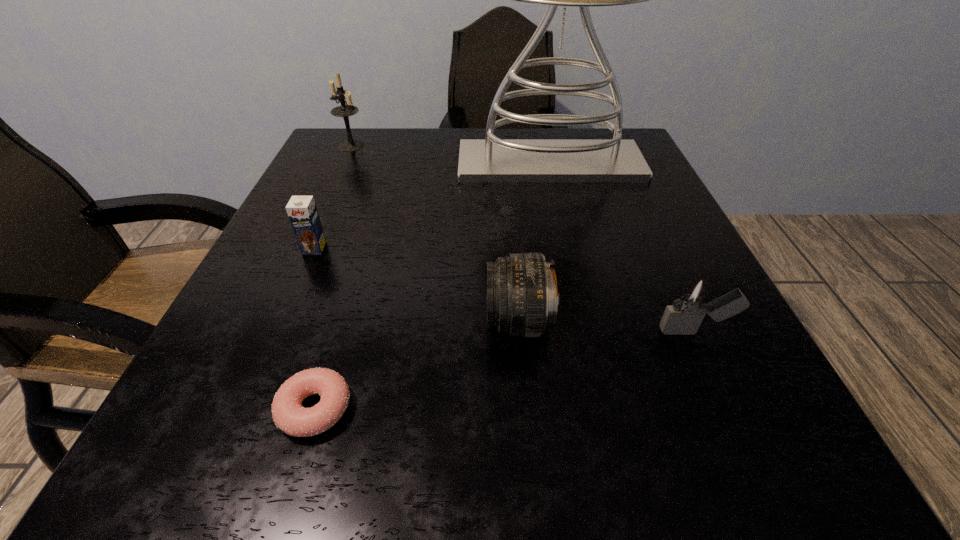
Find the location of a particular element. The height and width of the screenshot is (540, 960). free spot at the far left corner of the desktop is located at coordinates (370, 168).

This screenshot has height=540, width=960. In the image, there is a desktop. In order to click on vacant space at the near left corner in this screenshot , I will do `click(207, 418)`.

Find the location of a particular element. This screenshot has height=540, width=960. free space that is in between the third farthest object and the tallest object is located at coordinates (432, 206).

The image size is (960, 540). I want to click on unoccupied area between the table lamp and the fifth shortest object, so click(451, 155).

Locate an element on the screen. The height and width of the screenshot is (540, 960). free point between the table lamp and the igniter is located at coordinates [623, 247].

Locate an element on the screen. The width and height of the screenshot is (960, 540). free space between the candle holder and the igniter is located at coordinates (523, 238).

Locate an element on the screen. unoccupied area between the doughnut and the chocolate milk is located at coordinates point(315,328).

Locate an element on the screen. The height and width of the screenshot is (540, 960). free point between the second tallest object and the doughnut is located at coordinates (333, 277).

Find the location of a particular element. Image resolution: width=960 pixels, height=540 pixels. blank region between the nearest object and the candle holder is located at coordinates (333, 277).

Locate an element on the screen. This screenshot has height=540, width=960. vacant area that lies between the chocolate milk and the tallest object is located at coordinates (432, 206).